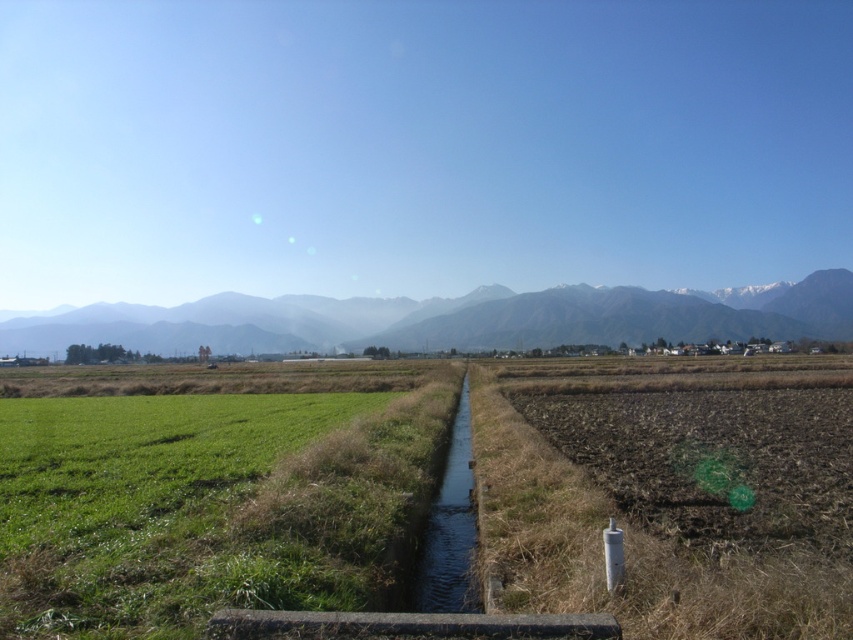
Is green grassy farmland at center smaller than green grass at lower left?

Incorrect, green grassy farmland at center is not smaller in size than green grass at lower left.

Does point (381, 388) lie in front of point (94, 442)?

No, (381, 388) is further to viewer.

What are the coordinates of `green grassy farmland at center` in the screenshot? It's located at click(x=212, y=493).

Can you confirm if green grass at lower left is positioned above grayish-brown mountain range at center?

Incorrect, green grass at lower left is not positioned above grayish-brown mountain range at center.

From the picture: Is green grass at lower left positioned behind grayish-brown mountain range at center?

No, green grass at lower left is closer to the viewer.

The width and height of the screenshot is (853, 640). Describe the element at coordinates (132, 493) in the screenshot. I see `green grass at lower left` at that location.

Image resolution: width=853 pixels, height=640 pixels. Identify the location of green grass at lower left. (132, 493).

Consider the image. Is the position of green grass at lower left less distant than that of clear water at center?

Yes.

Which is above, green grass at lower left or clear water at center?

green grass at lower left is above.

Identify the location of green grass at lower left. (132, 493).